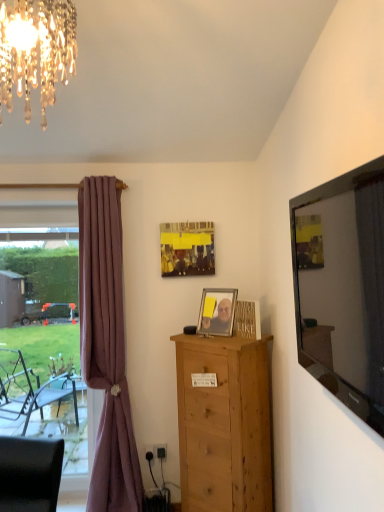
Locate an element on the screen. The height and width of the screenshot is (512, 384). vacant point above clear glass window at left (from a real-world perspective) is located at coordinates (40, 231).